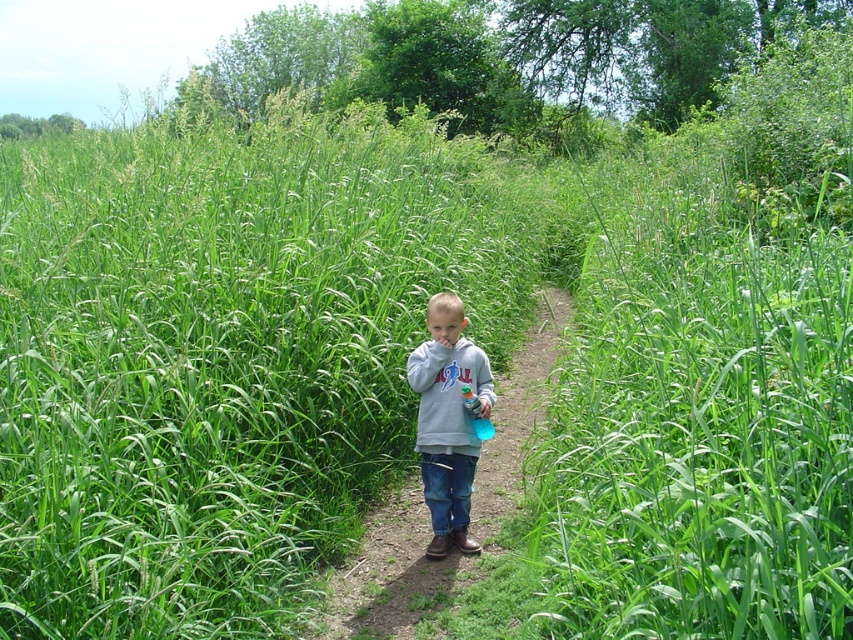
The child is wearing two gray sweatshirts. Which one is closer to the ground, the gray sweatshirt at center or the gray fleece sweatshirt at center?

The gray sweatshirt at center is closer to the ground because it is positioned below the gray fleece sweatshirt at center.

The child is wearing two layers on their torso. Which layer is narrower? Please choose between the gray sweatshirt at center and the gray fleece sweatshirt at center.

The gray sweatshirt at center is narrower than the gray fleece sweatshirt at center.

Based on the photo, you are a photographer taking a picture of the child on the path. You notice two points in the scene marked as point 1 at coordinates (x=410, y=512) and point 2 at coordinates (x=457, y=401). Which point is closer to the camera?

Point 2 at coordinates (x=457, y=401) is closer to the camera because the description states that point 1 is further away than point 2.